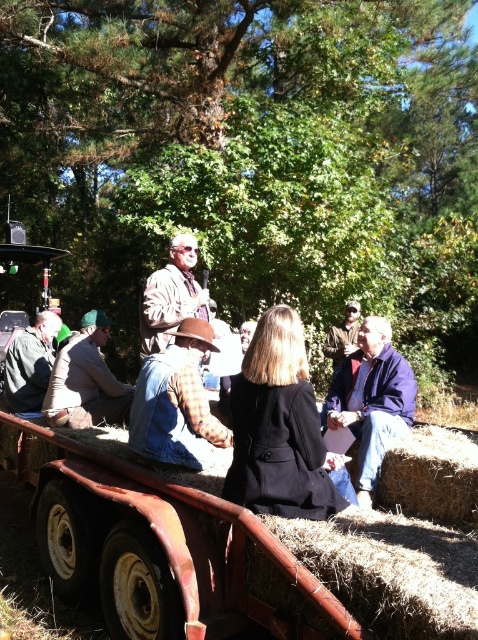
You are standing in front of the red trailer with hay bales. There are two points marked on the trailer. One is at coordinate point (x=216, y=464) and the other is at point (x=330, y=326). Which point is closer to you?

Point (x=216, y=464) is closer to the viewer than point (x=330, y=326).